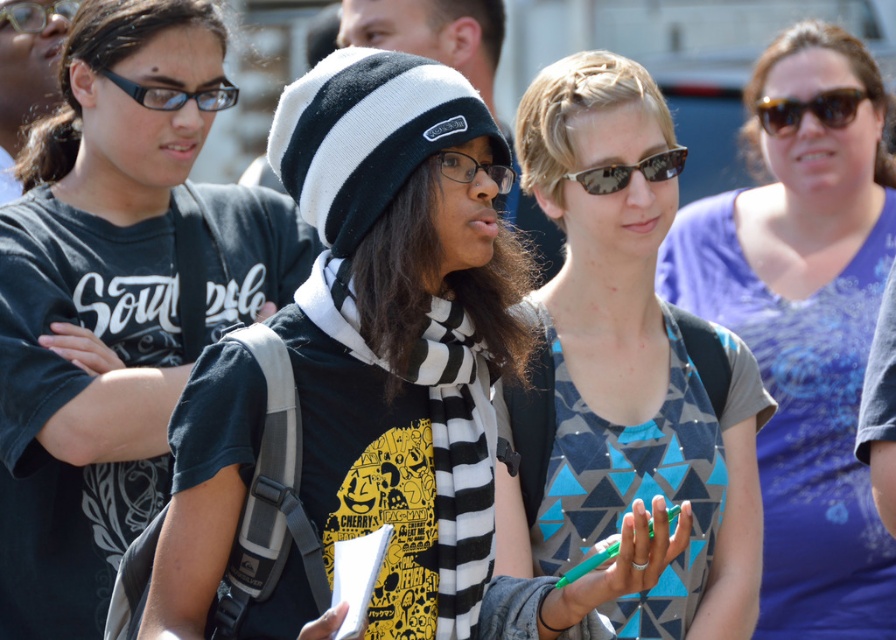
Question: Is matte black glasses at upper left to the right of clear plastic goggles at upper left from the viewer's perspective?

Choices:
 (A) yes
 (B) no

Answer: (A)

Question: Is matte black t-shirt at center positioned before camouflage-patterned sunglasses at center?

Choices:
 (A) yes
 (B) no

Answer: (A)

Question: Which of the following is the closest to the observer?

Choices:
 (A) clear plastic goggles at upper left
 (B) black and white striped beanie at center
 (C) camouflage-patterned sunglasses at center
 (D) black plastic sunglasses at upper right

Answer: (B)

Question: Is geometric-patterned shirt at center closer to the viewer compared to matte black glasses at upper left?

Choices:
 (A) no
 (B) yes

Answer: (B)

Question: Estimate the real-world distances between objects in this image. Which object is closer to the blue printed scarf at center?

Choices:
 (A) clear plastic glasses at center
 (B) black plastic sunglasses at upper right

Answer: (B)

Question: Which point is farther to the camera?

Choices:
 (A) (602, 192)
 (B) (582, 54)

Answer: (B)